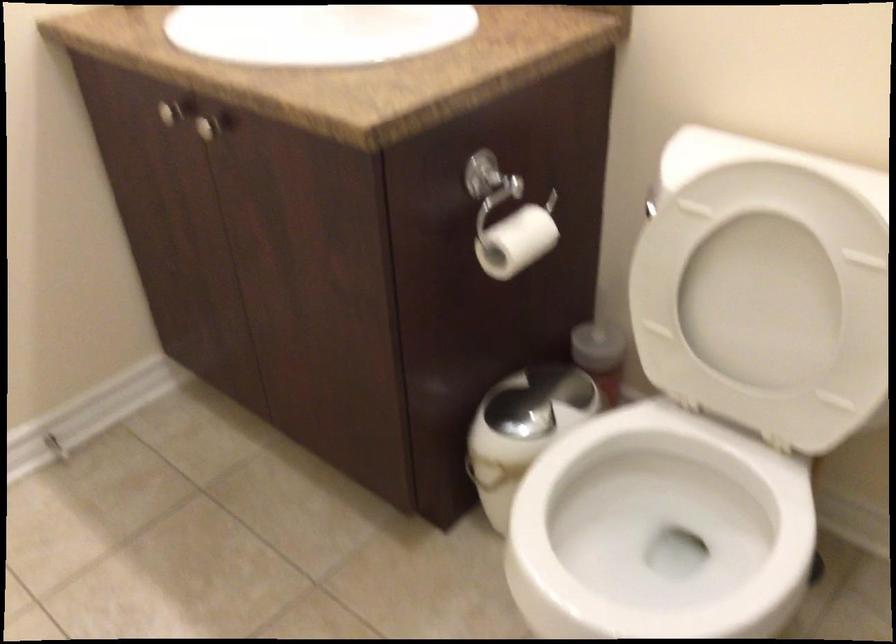
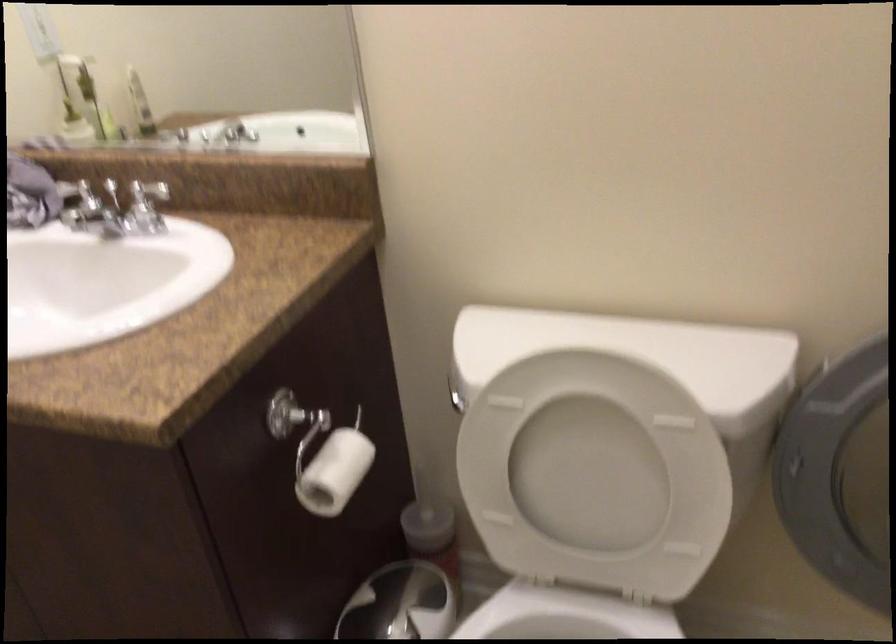
Which direction would the cameraman need to move to produce the second image?

The cameraman moved toward left, forward.